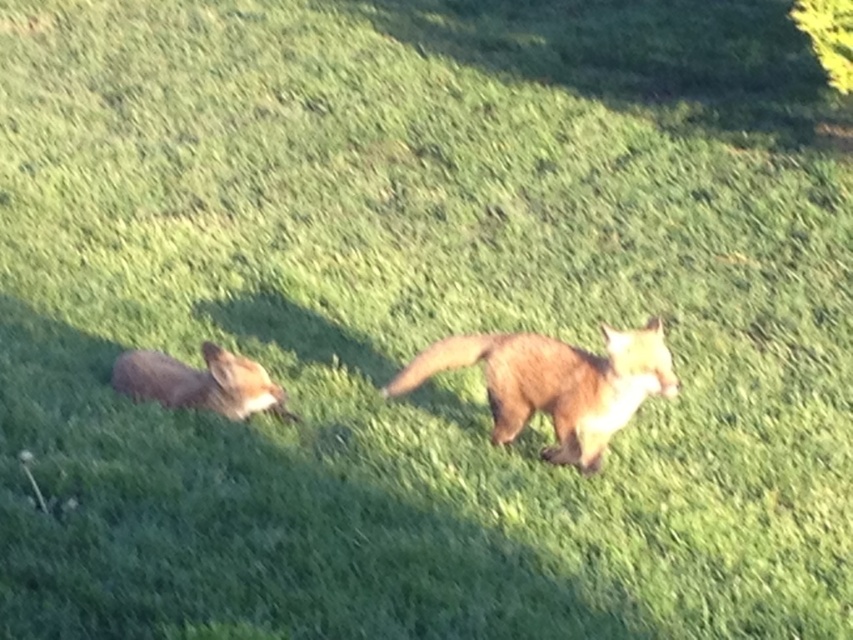
Does brown furry fox at center come behind fluffy reddish-brown fox at left?

A: No, brown furry fox at center is closer to the viewer.

Is brown furry fox at center taller than fluffy reddish-brown fox at left?

Yes.

Does point (583, 464) come closer to viewer compared to point (160, 353)?

That is True.

Locate an element on the screen. Image resolution: width=853 pixels, height=640 pixels. brown furry fox at center is located at coordinates (556, 384).